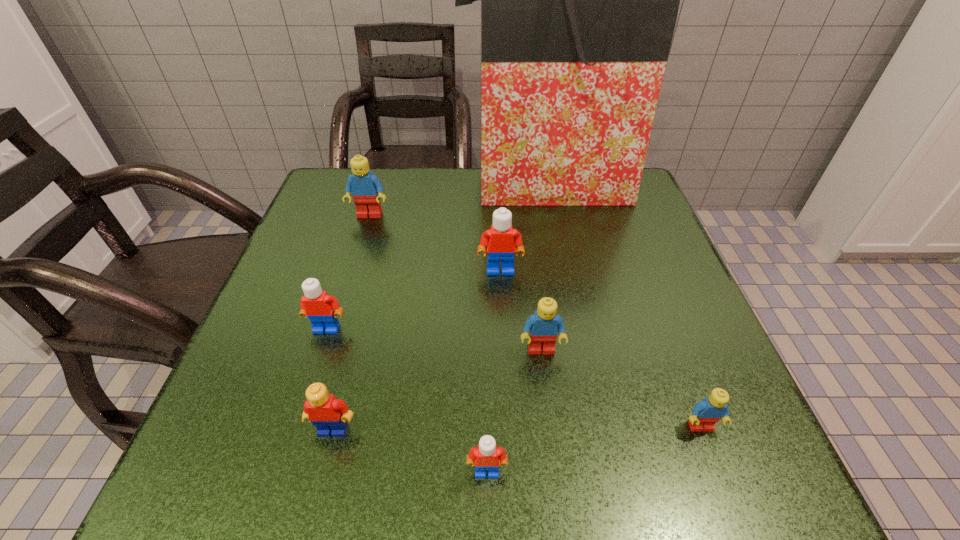
Locate which Lego ranks fourth in proximity to the farthest white Lego. Please provide its 2D coordinates. Your answer should be formatted as a tuple, i.e. [(x, y)], where the tuple contains the x and y coordinates of a point satisfying the conditions above.

[(328, 414)]

The width and height of the screenshot is (960, 540). I want to click on the closest blue Lego to the fourth nearest object, so click(706, 413).

Locate an element on the screen. The image size is (960, 540). blue Lego identified as the second closest to the smallest blue Lego is located at coordinates (366, 189).

Identify the location of white Lego that can be found as the closest to the sixth nearest object. This screenshot has height=540, width=960. (318, 306).

Locate an element on the screen. white Lego that stands as the second closest to the fourth nearest Lego is located at coordinates (486, 456).